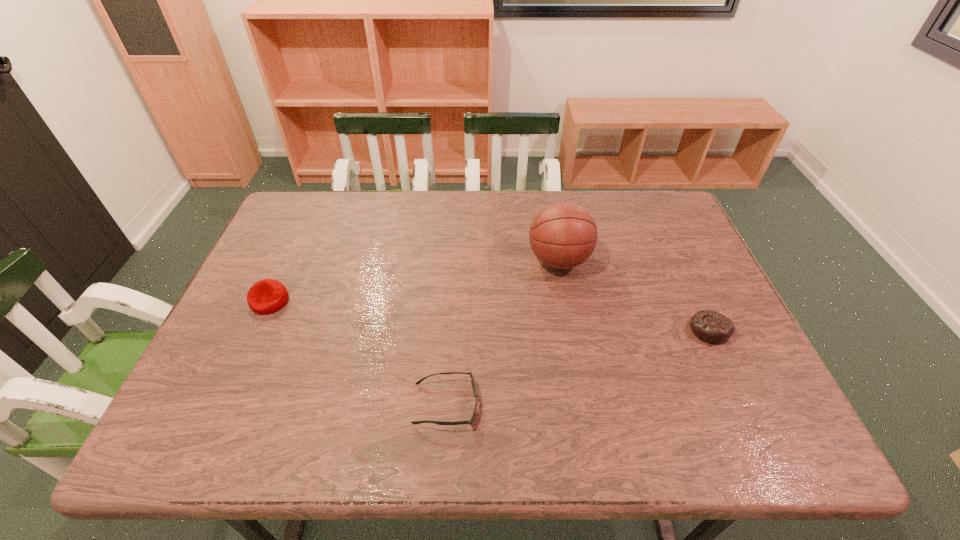
Identify the location of the tallest object. Image resolution: width=960 pixels, height=540 pixels. (563, 235).

What are the coordinates of `the third object from left to right` in the screenshot? It's located at (563, 235).

Find the location of `the left beanbag`. the left beanbag is located at coordinates pyautogui.click(x=266, y=296).

The width and height of the screenshot is (960, 540). I want to click on the taller beanbag, so click(x=266, y=296).

Find the location of a particular element. This screenshot has height=540, width=960. the second shortest object is located at coordinates (711, 327).

The width and height of the screenshot is (960, 540). I want to click on the shorter beanbag, so click(x=711, y=327).

Where is `sunglasses`? This screenshot has width=960, height=540. sunglasses is located at coordinates tap(473, 383).

The width and height of the screenshot is (960, 540). Find the location of `the nearest object`. the nearest object is located at coordinates (473, 383).

The width and height of the screenshot is (960, 540). I want to click on blank area located on the back of the farthest object, so click(547, 199).

Where is `vacant area located 0.190m on the seat area of the leftmost object`? vacant area located 0.190m on the seat area of the leftmost object is located at coordinates (234, 380).